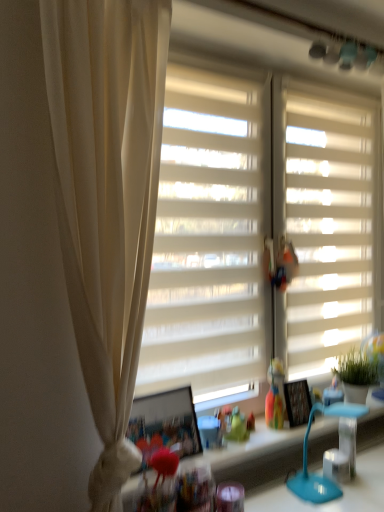
Measure the distance between white matte window blind at right and camera.

white matte window blind at right is 1.75 meters from camera.

What are the coordinates of `white matte window screen at center` in the screenshot? It's located at (206, 243).

Can you confirm if matte blue table lamp at lower right is taller than white matte window screen at center?

Incorrect, the height of matte blue table lamp at lower right is not larger of that of white matte window screen at center.

Which is in front, point (321, 407) or point (201, 302)?

The point (321, 407) is closer.

Is the depth of white matte window screen at center greater than that of matte blue table lamp at lower right?

Yes, white matte window screen at center is further from the viewer.

Does white matte window screen at center have a larger size compared to matte blue table lamp at lower right?

Indeed, white matte window screen at center has a larger size compared to matte blue table lamp at lower right.

Which point is more distant from viewer, (233,203) or (306,471)?

Positioned behind is point (233,203).

Is matte blue table lamp at lower right at the back of white matte window screen at center?

No, white matte window screen at center is not facing the opposite direction of matte blue table lamp at lower right.

Can white matte window screen at center be found inside translucent plastic toy at center?

No, white matte window screen at center is not inside translucent plastic toy at center.

From a real-world perspective, is translucent plastic toy at center positioned over white matte window screen at center based on gravity?

No, from a real-world perspective, translucent plastic toy at center is not above white matte window screen at center.

Find the location of `window screen in front of the translucent plastic toy at center`. window screen in front of the translucent plastic toy at center is located at coordinates (206, 243).

From the picture: Considering the relative sizes of translucent plastic toy at center and matte blue table lamp at lower right in the image provided, is translucent plastic toy at center smaller than matte blue table lamp at lower right?

Yes.

Does translucent plastic toy at center turn towards matte blue table lamp at lower right?

Yes, translucent plastic toy at center is facing matte blue table lamp at lower right.

From the image's perspective, relative to matte blue table lamp at lower right, is translucent plastic toy at center above or below?

From the image's perspective, translucent plastic toy at center appears above matte blue table lamp at lower right.

Is translucent plastic toy at center to the left or to the right of matte blue table lamp at lower right in the image?

translucent plastic toy at center is to the left of matte blue table lamp at lower right.

From a real-world perspective, which object rests below the other?

In real-world perspective, white matte window screen at center is lower.

Which object is wider, white matte window blind at right or white matte window screen at center?

white matte window screen at center is wider.

Relative to white matte window screen at center, is white matte window blind at right in front or behind?

Visually, white matte window blind at right is located behind white matte window screen at center.

I want to click on window blind above the white matte window screen at center (from the image's perspective), so click(x=331, y=226).

From the image's perspective, is white matte window blind at right above or below matte blue table lamp at lower right?

From the image's perspective, white matte window blind at right appears above matte blue table lamp at lower right.

What are the coordinates of `table lamp in front of the white matte window blind at right` in the screenshot? It's located at (307, 457).

Is white matte window blind at right touching matte blue table lamp at lower right?

There is a gap between white matte window blind at right and matte blue table lamp at lower right.

From a real-world perspective, relative to matte blue table lamp at lower right, is white matte window blind at right vertically above or below?

Clearly, from a real-world perspective, white matte window blind at right is above matte blue table lamp at lower right.

Considering the positions of objects white matte window screen at center and white matte window blind at right in the image provided, who is more to the left, white matte window screen at center or white matte window blind at right?

From the viewer's perspective, white matte window screen at center appears more on the left side.

Is white matte window screen at center completely or partially outside of white matte window blind at right?

white matte window screen at center lies outside white matte window blind at right's area.

Is point (176, 328) closer or farther from the camera than point (366, 242)?

Point (176, 328) is closer to the camera than point (366, 242).

Measure the distance between white matte window screen at center and white matte window blind at right.

The distance of white matte window screen at center from white matte window blind at right is 42.46 centimeters.

You are a GUI agent. You are given a task and a screenshot of the screen. Output one action in this format:
    pyautogui.click(x=<x>, y=<y>)
    Task: Click on the table lamp in front of the white matte window screen at center
    This screenshot has height=512, width=384.
    Given the screenshot: What is the action you would take?
    pyautogui.click(x=307, y=457)

Locate an element on the screen. window screen above the matte blue table lamp at lower right (from the image's perspective) is located at coordinates (206, 243).

Which object lies nearer to the anchor point white matte window blind at right, white matte window screen at center or matte blue table lamp at lower right?

white matte window screen at center.

From the image, which object appears to be farther from white matte window screen at center, translucent plastic toy at center or matte blue table lamp at lower right?

The object further to white matte window screen at center is matte blue table lamp at lower right.

Looking at the image, which one is located further to translucent plastic toy at center, white matte window screen at center or white matte window blind at right?

white matte window blind at right.

From the image, which object appears to be nearer to white matte window blind at right, translucent plastic toy at center or white matte window screen at center?

white matte window screen at center is closer to white matte window blind at right.

Based on their spatial positions, is white matte window blind at right or translucent plastic toy at center closer to white matte window screen at center?

Based on the image, white matte window blind at right appears to be nearer to white matte window screen at center.

Looking at the image, which one is located closer to translucent plastic toy at center, white matte window screen at center or matte blue table lamp at lower right?

The object closer to translucent plastic toy at center is matte blue table lamp at lower right.

Looking at the image, which one is located closer to translucent plastic toy at center, white matte window blind at right or matte blue table lamp at lower right?

matte blue table lamp at lower right lies closer to translucent plastic toy at center than the other object.

Estimate the real-world distances between objects in this image. Which object is further from white matte window screen at center, translucent plastic toy at center or white matte window blind at right?

translucent plastic toy at center.

Find the location of `toy between white matte window blind at right and matte blue table lamp at lower right vertically`. toy between white matte window blind at right and matte blue table lamp at lower right vertically is located at coordinates pos(274,395).

Locate an element on the screen. The height and width of the screenshot is (512, 384). window screen between white matte window blind at right and translucent plastic toy at center from top to bottom is located at coordinates (206, 243).

Image resolution: width=384 pixels, height=512 pixels. Find the location of `window screen between white matte window blind at right and matte blue table lamp at lower right vertically`. window screen between white matte window blind at right and matte blue table lamp at lower right vertically is located at coordinates (206, 243).

Locate an element on the screen. The image size is (384, 512). toy between white matte window screen at center and matte blue table lamp at lower right from top to bottom is located at coordinates (274, 395).